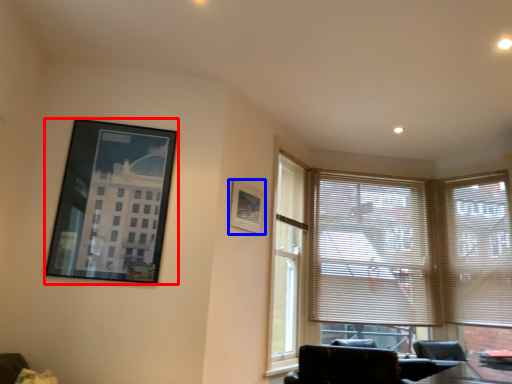
Question: Among these objects, which one is nearest to the camera, picture frame (highlighted by a red box) or picture frame (highlighted by a blue box)?

Choices:
 (A) picture frame
 (B) picture frame

Answer: (A)